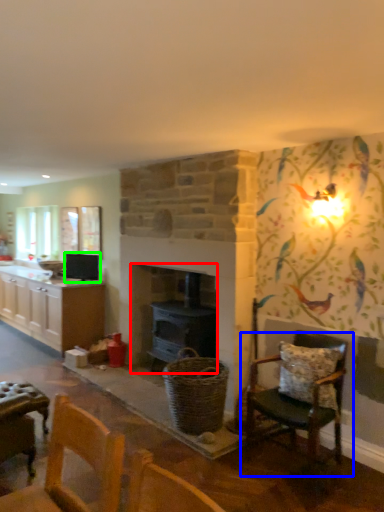
Question: Considering the real-world distances, which object is farthest from fireplace (highlighted by a red box)? chair (highlighted by a blue box) or appliance (highlighted by a green box)?

Choices:
 (A) chair
 (B) appliance

Answer: (B)